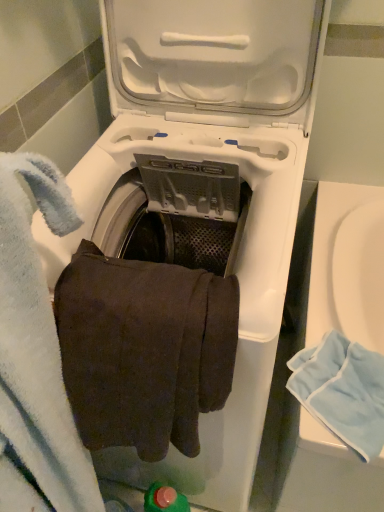
You are a GUI agent. You are given a task and a screenshot of the screen. Output one action in this format:
    pyautogui.click(x=<x>, y=<y>)
    Task: Click on the light blue cotton towel at lower right, which is the first bath towel from right to left
    
    Given the screenshot: What is the action you would take?
    pyautogui.click(x=342, y=391)

What do you see at coordinates (342, 391) in the screenshot? I see `light blue cotton towel at lower right, which is the first bath towel from right to left` at bounding box center [342, 391].

Measure the distance between brown cotton towel at center, the 2th bath towel positioned from the right, and camera.

20.28 inches.

Image resolution: width=384 pixels, height=512 pixels. What do you see at coordinates (144, 350) in the screenshot? I see `brown cotton towel at center, the first bath towel viewed from the left` at bounding box center [144, 350].

In order to face brown cotton towel at center, the 2th bath towel positioned from the right, should I rotate leftwards or rightwards?

To align with it, rotate left about 5.645°.

Image resolution: width=384 pixels, height=512 pixels. I want to click on brown cotton towel at center, the 2th bath towel positioned from the right, so click(x=144, y=350).

This screenshot has width=384, height=512. Find the location of `light blue cotton towel at lower right, which is the first bath towel from right to left`. light blue cotton towel at lower right, which is the first bath towel from right to left is located at coordinates (342, 391).

Between light blue cotton towel at lower right, which ranks as the second bath towel in left-to-right order, and brown cotton towel at center, the 2th bath towel positioned from the right, which one appears on the left side from the viewer's perspective?

brown cotton towel at center, the 2th bath towel positioned from the right, is more to the left.

Is light blue cotton towel at lower right, which ranks as the second bath towel in left-to-right order, in front of or behind brown cotton towel at center, the 2th bath towel positioned from the right, in the image?

Clearly, light blue cotton towel at lower right, which ranks as the second bath towel in left-to-right order, is behind brown cotton towel at center, the 2th bath towel positioned from the right.

Which point is more distant from viewer, (373, 448) or (161, 422)?

The point (373, 448) is behind.

From the image's perspective, is light blue cotton towel at lower right, which is the first bath towel from right to left, above brown cotton towel at center, the 2th bath towel positioned from the right?

Actually, light blue cotton towel at lower right, which is the first bath towel from right to left, appears below brown cotton towel at center, the 2th bath towel positioned from the right, in the image.

From a real-world perspective, which object rests below the other?

From a 3D spatial view, light blue cotton towel at lower right, which ranks as the second bath towel in left-to-right order, is below.

Considering the relative sizes of light blue cotton towel at lower right, which is the first bath towel from right to left, and brown cotton towel at center, the 2th bath towel positioned from the right, in the image provided, is light blue cotton towel at lower right, which is the first bath towel from right to left, thinner than brown cotton towel at center, the 2th bath towel positioned from the right,?

No, light blue cotton towel at lower right, which is the first bath towel from right to left, is not thinner than brown cotton towel at center, the 2th bath towel positioned from the right.

Does light blue cotton towel at lower right, which is the first bath towel from right to left, have a lesser height compared to brown cotton towel at center, the 2th bath towel positioned from the right?

Correct, light blue cotton towel at lower right, which is the first bath towel from right to left, is not as tall as brown cotton towel at center, the 2th bath towel positioned from the right.

Is light blue cotton towel at lower right, which is the first bath towel from right to left, bigger than brown cotton towel at center, the 2th bath towel positioned from the right?

Incorrect, light blue cotton towel at lower right, which is the first bath towel from right to left, is not larger than brown cotton towel at center, the 2th bath towel positioned from the right.

Is light blue cotton towel at lower right, which is the first bath towel from right to left, positioned beyond the bounds of brown cotton towel at center, the 2th bath towel positioned from the right?

Yes, light blue cotton towel at lower right, which is the first bath towel from right to left, is located beyond the bounds of brown cotton towel at center, the 2th bath towel positioned from the right.

Are light blue cotton towel at lower right, which is the first bath towel from right to left, and brown cotton towel at center, the 2th bath towel positioned from the right, far apart?

No, light blue cotton towel at lower right, which is the first bath towel from right to left, is in close proximity to brown cotton towel at center, the 2th bath towel positioned from the right.

Is light blue cotton towel at lower right, which ranks as the second bath towel in left-to-right order, oriented towards brown cotton towel at center, the first bath towel viewed from the left?

No, light blue cotton towel at lower right, which ranks as the second bath towel in left-to-right order, is not facing towards brown cotton towel at center, the first bath towel viewed from the left.

Can you tell me how much light blue cotton towel at lower right, which is the first bath towel from right to left, and brown cotton towel at center, the first bath towel viewed from the left, differ in facing direction?

The angle between the facing direction of light blue cotton towel at lower right, which is the first bath towel from right to left, and the facing direction of brown cotton towel at center, the first bath towel viewed from the left, is 3.42 degrees.

How far apart are light blue cotton towel at lower right, which is the first bath towel from right to left, and brown cotton towel at center, the first bath towel viewed from the left?

light blue cotton towel at lower right, which is the first bath towel from right to left, is 11.80 inches away from brown cotton towel at center, the first bath towel viewed from the left.

The image size is (384, 512). I want to click on bath towel on the right of the brown cotton towel at center, the first bath towel viewed from the left, so click(x=342, y=391).

Does brown cotton towel at center, the 2th bath towel positioned from the right, appear on the right side of light blue cotton towel at lower right, which is the first bath towel from right to left?

In fact, brown cotton towel at center, the 2th bath towel positioned from the right, is to the left of light blue cotton towel at lower right, which is the first bath towel from right to left.

Which object is closer to the camera, brown cotton towel at center, the 2th bath towel positioned from the right, or light blue cotton towel at lower right, which is the first bath towel from right to left?

brown cotton towel at center, the 2th bath towel positioned from the right, is more forward.

Does point (83, 296) come in front of point (383, 386)?

That is True.

From the image's perspective, which object appears higher, brown cotton towel at center, the 2th bath towel positioned from the right, or light blue cotton towel at lower right, which ranks as the second bath towel in left-to-right order?

brown cotton towel at center, the 2th bath towel positioned from the right.

From a real-world perspective, is brown cotton towel at center, the 2th bath towel positioned from the right, beneath light blue cotton towel at lower right, which ranks as the second bath towel in left-to-right order?

No, from a real-world perspective, brown cotton towel at center, the 2th bath towel positioned from the right, is not beneath light blue cotton towel at lower right, which ranks as the second bath towel in left-to-right order.

Does brown cotton towel at center, the first bath towel viewed from the left, have a lesser width compared to light blue cotton towel at lower right, which is the first bath towel from right to left?

Yes.

From their relative heights in the image, would you say brown cotton towel at center, the 2th bath towel positioned from the right, is taller or shorter than light blue cotton towel at lower right, which is the first bath towel from right to left?

Clearly, brown cotton towel at center, the 2th bath towel positioned from the right, is taller compared to light blue cotton towel at lower right, which is the first bath towel from right to left.

Between brown cotton towel at center, the 2th bath towel positioned from the right, and light blue cotton towel at lower right, which ranks as the second bath towel in left-to-right order, which one has smaller size?

Smaller between the two is light blue cotton towel at lower right, which ranks as the second bath towel in left-to-right order.

Is brown cotton towel at center, the 2th bath towel positioned from the right, located outside light blue cotton towel at lower right, which is the first bath towel from right to left?

Yes, brown cotton towel at center, the 2th bath towel positioned from the right, is not within light blue cotton towel at lower right, which is the first bath towel from right to left.

Are brown cotton towel at center, the first bath towel viewed from the left, and light blue cotton towel at lower right, which ranks as the second bath towel in left-to-right order, beside each other?

No, brown cotton towel at center, the first bath towel viewed from the left, is not making contact with light blue cotton towel at lower right, which ranks as the second bath towel in left-to-right order.

Is brown cotton towel at center, the first bath towel viewed from the left, positioned with its back to light blue cotton towel at lower right, which is the first bath towel from right to left?

No, brown cotton towel at center, the first bath towel viewed from the left, is not facing the opposite direction of light blue cotton towel at lower right, which is the first bath towel from right to left.

Measure the distance between brown cotton towel at center, the 2th bath towel positioned from the right, and light blue cotton towel at lower right, which ranks as the second bath towel in left-to-right order.

brown cotton towel at center, the 2th bath towel positioned from the right, and light blue cotton towel at lower right, which ranks as the second bath towel in left-to-right order, are 11.80 inches apart from each other.

This screenshot has width=384, height=512. I want to click on bath towel above the light blue cotton towel at lower right, which ranks as the second bath towel in left-to-right order (from the image's perspective), so click(144, 350).

In order to click on bath towel below the brown cotton towel at center, the first bath towel viewed from the left (from the image's perspective) in this screenshot , I will do `click(342, 391)`.

Locate an element on the screen. The width and height of the screenshot is (384, 512). bath towel beneath the brown cotton towel at center, the 2th bath towel positioned from the right (from a real-world perspective) is located at coordinates (342, 391).